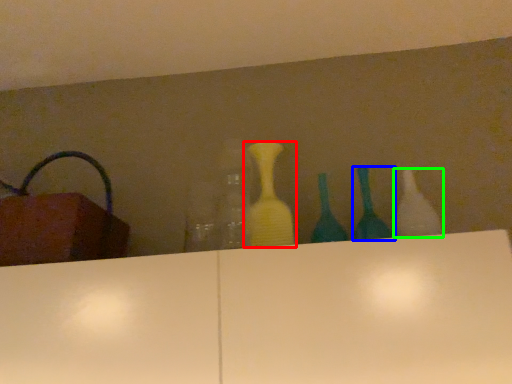
Question: Which object is the closest to the bottle (highlighted by a red box)? Choose among these: bottle (highlighted by a blue box) or bottle (highlighted by a green box).

Choices:
 (A) bottle
 (B) bottle

Answer: (A)